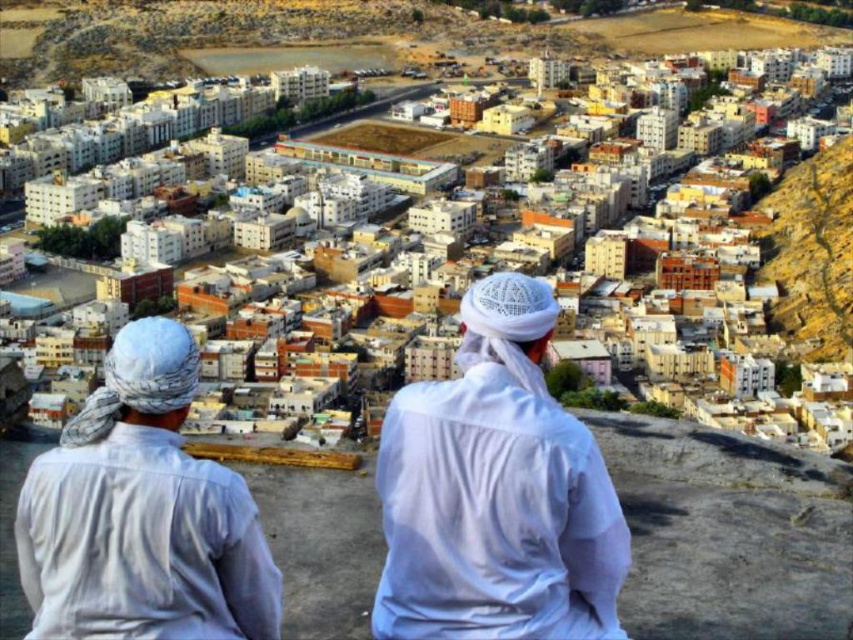
Does white cotton robe at center come in front of white cotton shirt at left?

No, white cotton robe at center is further to the viewer.

Who is higher up, white cotton robe at center or white cotton shirt at left?

white cotton robe at center

From the picture: Who is more forward, (415, 394) or (229, 516)?

Point (229, 516) is in front.

Locate an element on the screen. The image size is (853, 640). white cotton robe at center is located at coordinates (495, 492).

Is white cotton clothing at center in front of white cotton shirt at left?

No, white cotton clothing at center is behind white cotton shirt at left.

Consider the image. Between white cotton clothing at center and white cotton shirt at left, which one appears on the right side from the viewer's perspective?

white cotton clothing at center is more to the right.

Between point (544, 582) and point (84, 440), which one is positioned in front?

Point (544, 582) is more forward.

At what (x,y) coordinates should I click in order to perform the action: click on white cotton clothing at center. Please return your answer as a coordinate pair (x, y). This screenshot has height=640, width=853. Looking at the image, I should click on 496,492.

Who is higher up, white cotton clothing at center or white cotton robe at center?

white cotton clothing at center is above.

Is white cotton clothing at center to the right of white cotton robe at center from the viewer's perspective?

In fact, white cotton clothing at center is to the left of white cotton robe at center.

The height and width of the screenshot is (640, 853). I want to click on white cotton clothing at center, so click(x=496, y=492).